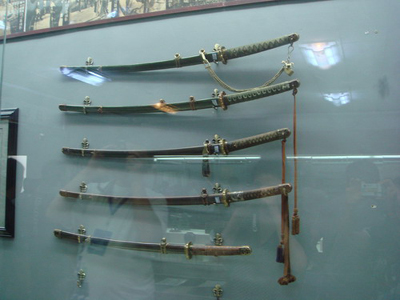
Find the location of a particular element. This screenshot has width=400, height=300. handle is located at coordinates [x=264, y=193].